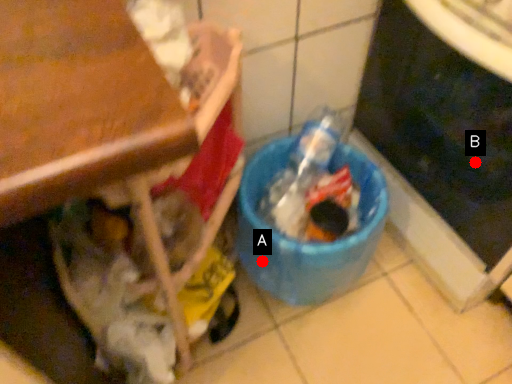
Question: Two points are circled on the image, labeled by A and B beside each circle. Which of the following is the closest to the observer?

Choices:
 (A) A is closer
 (B) B is closer

Answer: (A)